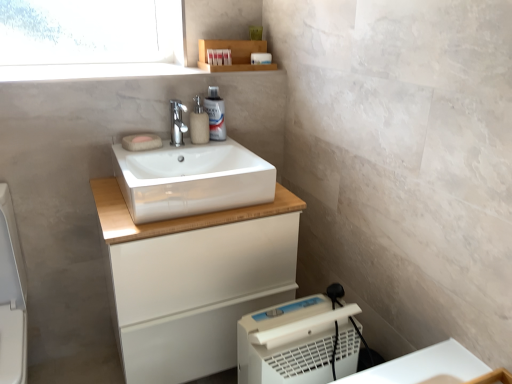
Measure the distance between point (x=190, y=205) and camera.

Point (x=190, y=205) is 1.22 meters away from camera.

Image resolution: width=512 pixels, height=384 pixels. What do you see at coordinates (191, 179) in the screenshot? I see `white glossy sink at center` at bounding box center [191, 179].

What do you see at coordinates (297, 342) in the screenshot?
I see `white plastic dehumidifier at lower right` at bounding box center [297, 342].

What do you see at coordinates (199, 123) in the screenshot? The height and width of the screenshot is (384, 512). I see `white matte soap dispenser at upper center` at bounding box center [199, 123].

Identify the location of white glossy sink at center. (191, 179).

From a real-world perspective, which object rests below the other?

white matte cabinet at center.

Who is shorter, white glossy sink at center or white matte cabinet at center?

With less height is white glossy sink at center.

Considering the relative sizes of white glossy sink at center and white matte cabinet at center in the image provided, is white glossy sink at center smaller than white matte cabinet at center?

Indeed, white glossy sink at center has a smaller size compared to white matte cabinet at center.

From the image's perspective, relative to white glossy lotion at upper center, placed as the first toiletry when sorted from bottom to top, is white matte soap dispenser at upper center above or below?

Based on their image positions, white matte soap dispenser at upper center is located beneath white glossy lotion at upper center, placed as the first toiletry when sorted from bottom to top.

Do you think white matte soap dispenser at upper center is within white glossy lotion at upper center, placed as the first toiletry when sorted from bottom to top, or outside of it?

white matte soap dispenser at upper center exists outside the volume of white glossy lotion at upper center, placed as the first toiletry when sorted from bottom to top.

Is white matte soap dispenser at upper center facing towards white glossy lotion at upper center, which appears as the fourth toiletry when viewed from the top?

No, white matte soap dispenser at upper center does not turn towards white glossy lotion at upper center, which appears as the fourth toiletry when viewed from the top.

Considering the positions of objects white matte cabinet at center and matte plastic container at upper center, which appears as the 2th toiletry when viewed from the top, in the image provided, who is behind, white matte cabinet at center or matte plastic container at upper center, which appears as the 2th toiletry when viewed from the top,?

matte plastic container at upper center, which appears as the 2th toiletry when viewed from the top, is behind.

Is white matte cabinet at center positioned with its back to matte plastic container at upper center, which appears as the 2th toiletry when viewed from the top?

That's not correct — white matte cabinet at center is not looking away from matte plastic container at upper center, which appears as the 2th toiletry when viewed from the top.

From a real-world perspective, is white matte cabinet at center physically below matte plastic container at upper center, marked as the 3th toiletry in a bottom-to-top arrangement?

Yes, from a real-world perspective, white matte cabinet at center is below matte plastic container at upper center, marked as the 3th toiletry in a bottom-to-top arrangement.

Which object is positioned more to the right, white matte cabinet at center or matte plastic container at upper center, marked as the 3th toiletry in a bottom-to-top arrangement?

Positioned to the right is matte plastic container at upper center, marked as the 3th toiletry in a bottom-to-top arrangement.

What's the angular difference between matte plastic container at upper center, the second toiletry in the bottom-to-top sequence, and white glossy sink at center's facing directions?

They differ by 0.699 degrees in their facing directions.

Between point (213, 55) and point (186, 169), which one is positioned in front?

The point (186, 169) is closer to the camera.

Where is `sink in front of the matte plastic container at upper center, the second toiletry in the bottom-to-top sequence`? Image resolution: width=512 pixels, height=384 pixels. sink in front of the matte plastic container at upper center, the second toiletry in the bottom-to-top sequence is located at coordinates (191, 179).

From a real-world perspective, is white glossy lotion at upper center, which appears as the fourth toiletry when viewed from the top, positioned above or below white matte cabinet at center?

white glossy lotion at upper center, which appears as the fourth toiletry when viewed from the top, is above white matte cabinet at center.

Which object is closer to the camera, white glossy lotion at upper center, which appears as the fourth toiletry when viewed from the top, or white matte cabinet at center?

white matte cabinet at center is in front.

Which is more to the right, white glossy lotion at upper center, placed as the first toiletry when sorted from bottom to top, or white matte cabinet at center?

From the viewer's perspective, white glossy lotion at upper center, placed as the first toiletry when sorted from bottom to top, appears more on the right side.

Considering the sizes of white glossy lotion at upper center, placed as the first toiletry when sorted from bottom to top, and white matte cabinet at center in the image, is white glossy lotion at upper center, placed as the first toiletry when sorted from bottom to top, wider or thinner than white matte cabinet at center?

white glossy lotion at upper center, placed as the first toiletry when sorted from bottom to top, is thinner than white matte cabinet at center.

Considering the sizes of objects white plastic container at upper center, which appears as the 1th toiletry when viewed from the top, and matte plastic container at upper center, which appears as the 2th toiletry when viewed from the top, in the image provided, who is shorter, white plastic container at upper center, which appears as the 1th toiletry when viewed from the top, or matte plastic container at upper center, which appears as the 2th toiletry when viewed from the top,?

white plastic container at upper center, which appears as the 1th toiletry when viewed from the top.

Consider the image. From the image's perspective, which is below, white plastic container at upper center, which appears as the 1th toiletry when viewed from the top, or matte plastic container at upper center, marked as the 3th toiletry in a bottom-to-top arrangement?

matte plastic container at upper center, marked as the 3th toiletry in a bottom-to-top arrangement, appears lower in the image.

Is white plastic container at upper center, which appears as the 1th toiletry when viewed from the top, not within matte plastic container at upper center, which appears as the 2th toiletry when viewed from the top?

Absolutely, white plastic container at upper center, which appears as the 1th toiletry when viewed from the top, is external to matte plastic container at upper center, which appears as the 2th toiletry when viewed from the top.

Looking at this image, could you tell me if white plastic container at upper center, the 4th toiletry when ordered from bottom to top, is turned towards matte plastic container at upper center, marked as the 3th toiletry in a bottom-to-top arrangement?

No.

From a real-world perspective, is white plastic dehumidifier at lower right on top of matte plastic container at upper center, which appears as the 2th toiletry when viewed from the top?

No, from a real-world perspective, white plastic dehumidifier at lower right is not above matte plastic container at upper center, which appears as the 2th toiletry when viewed from the top.

Between white plastic dehumidifier at lower right and matte plastic container at upper center, which appears as the 2th toiletry when viewed from the top, which one has less height?

Standing shorter between the two is matte plastic container at upper center, which appears as the 2th toiletry when viewed from the top.

Can you confirm if white plastic dehumidifier at lower right is bigger than matte plastic container at upper center, which appears as the 2th toiletry when viewed from the top?

Indeed, white plastic dehumidifier at lower right has a larger size compared to matte plastic container at upper center, which appears as the 2th toiletry when viewed from the top.

You are a GUI agent. You are given a task and a screenshot of the screen. Output one action in this format:
    pyautogui.click(x=<x>, y=<y>)
    Task: Click on the bathroom cabinet directly beneath the white glossy sink at center (from a real-world perspective)
    This screenshot has width=512, height=384.
    Given the screenshot: What is the action you would take?
    pyautogui.click(x=193, y=281)

The height and width of the screenshot is (384, 512). In order to click on the 1st toiletry above the white matte soap dispenser at upper center (from the image's perspective) in this screenshot , I will do `click(215, 114)`.

Based on the photo, when comparing their distances from wooden shelf at upper center, does white matte soap dispenser at upper center or white plastic container at upper center, which appears as the 1th toiletry when viewed from the top, seem closer?

white plastic container at upper center, which appears as the 1th toiletry when viewed from the top, is positioned closer to the anchor wooden shelf at upper center.

In the scene shown: When comparing their distances from beige fabric soap at upper center, arranged as the second soap when viewed from the back, does wooden shelf at upper center or matte beige soap at center, which is the second soap from front to back, seem further?

Based on the image, wooden shelf at upper center appears to be further to beige fabric soap at upper center, arranged as the second soap when viewed from the back.

In the scene shown: When comparing their distances from polished chrome faucet at center, does white glossy porcelain at lower left or matte beige soap at center, which is the second soap from front to back, seem further?

white glossy porcelain at lower left is further to polished chrome faucet at center.

When comparing their distances from white matte cabinet at center, does white plastic dehumidifier at lower right or white glossy lotion at upper center, placed as the first toiletry when sorted from bottom to top, seem further?

white glossy lotion at upper center, placed as the first toiletry when sorted from bottom to top.

Estimate the real-world distances between objects in this image. Which object is further from white matte cabinet at center, white plastic dehumidifier at lower right or matte plastic container at upper center, which is the third toiletry in top-to-bottom order?

matte plastic container at upper center, which is the third toiletry in top-to-bottom order.

Considering their positions, is matte plastic container at upper center, marked as the 3th toiletry in a bottom-to-top arrangement, positioned closer to matte plastic container at upper center, the second toiletry in the bottom-to-top sequence, than white matte soap dispenser at upper center?

matte plastic container at upper center, marked as the 3th toiletry in a bottom-to-top arrangement, is closer to matte plastic container at upper center, the second toiletry in the bottom-to-top sequence.

Considering their positions, is white glossy lotion at upper center, which appears as the fourth toiletry when viewed from the top, positioned further to white glossy porcelain at lower left than white plastic dehumidifier at lower right?

white glossy lotion at upper center, which appears as the fourth toiletry when viewed from the top, is further to white glossy porcelain at lower left.

Estimate the real-world distances between objects in this image. Which object is closer to white plastic dehumidifier at lower right, matte beige soap at center, which is the second soap from front to back, or polished chrome faucet at center?

The object closer to white plastic dehumidifier at lower right is polished chrome faucet at center.

What are the coordinates of `tap between white plastic container at upper center, the 4th toiletry when ordered from bottom to top, and beige fabric soap at upper center, which is the first soap from front to back, in the up-down direction` in the screenshot? It's located at (177, 122).

What are the coordinates of `toiletry between matte plastic container at upper center, which appears as the 2th toiletry when viewed from the top, and white glossy lotion at upper center, placed as the first toiletry when sorted from bottom to top, vertically` in the screenshot? It's located at (210, 56).

Where is `bathroom cabinet that lies between matte plastic container at upper center, marked as the 3th toiletry in a bottom-to-top arrangement, and white glossy porcelain at lower left from top to bottom`? This screenshot has width=512, height=384. bathroom cabinet that lies between matte plastic container at upper center, marked as the 3th toiletry in a bottom-to-top arrangement, and white glossy porcelain at lower left from top to bottom is located at coordinates (193, 281).

In order to click on tap between white matte soap dispenser at upper center and white plastic dehumidifier at lower right in the vertical direction in this screenshot , I will do `click(177, 122)`.